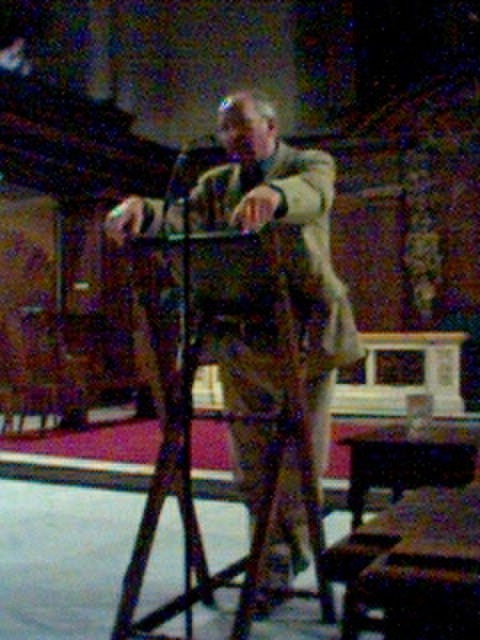
Between point (309, 484) and point (205, 141), which one is positioned in front?

Point (309, 484)

Which is more to the left, black matte tripod at center or matte black microphone at center?

Positioned to the left is matte black microphone at center.

Which is behind, point (305, 392) or point (214, 131)?

Positioned behind is point (214, 131).

The image size is (480, 640). In order to click on black matte tripod at center in this screenshot , I will do `click(190, 465)`.